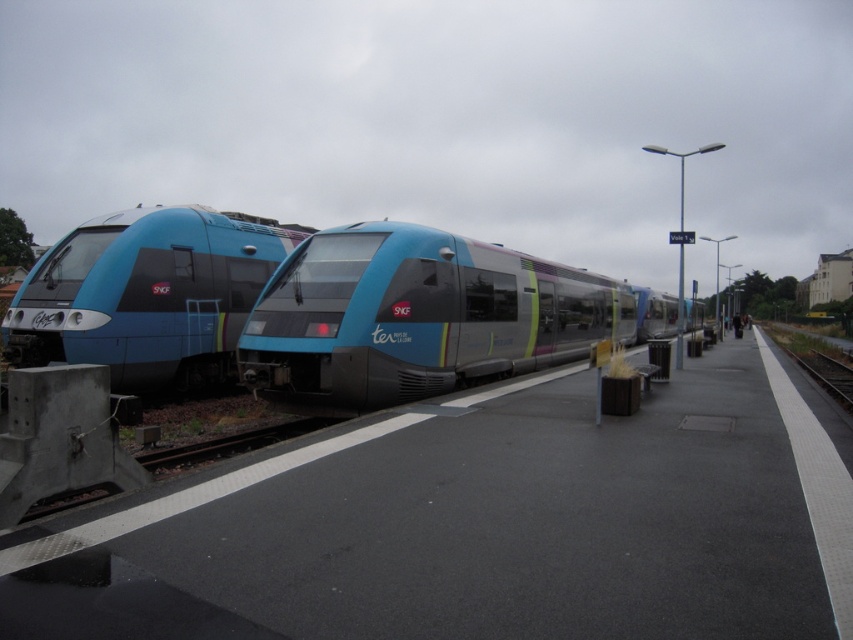
Question: Which point appears closest to the camera in this image?

Choices:
 (A) (91, 308)
 (B) (468, 349)

Answer: (A)

Question: Does metallic silver train at center come behind matte blue train at left?

Choices:
 (A) yes
 (B) no

Answer: (B)

Question: Does metallic silver train at center lie behind matte blue train at left?

Choices:
 (A) no
 (B) yes

Answer: (A)

Question: Is metallic silver train at center bigger than matte blue train at left?

Choices:
 (A) yes
 (B) no

Answer: (B)